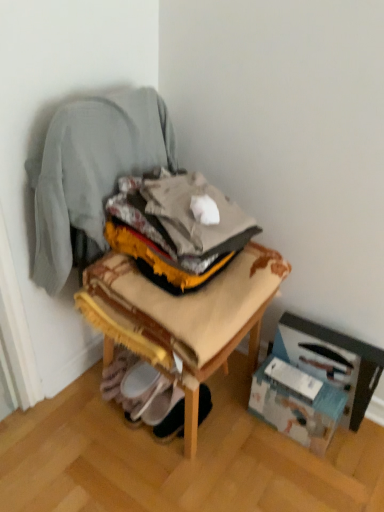
Question: From a real-world perspective, is wooden stool at center under white fabric shoe at lower center?

Choices:
 (A) yes
 (B) no

Answer: (B)

Question: Is wooden stool at center looking in the opposite direction of white fabric shoe at lower center?

Choices:
 (A) no
 (B) yes

Answer: (A)

Question: Is wooden stool at center directly adjacent to white fabric shoe at lower center?

Choices:
 (A) no
 (B) yes

Answer: (A)

Question: Does wooden stool at center appear on the right side of white fabric shoe at lower center?

Choices:
 (A) no
 (B) yes

Answer: (B)

Question: From the image's perspective, is wooden stool at center under white fabric shoe at lower center?

Choices:
 (A) yes
 (B) no

Answer: (B)

Question: Considering the positions of white fabric shoe at lower center and wooden chair at center in the image, is white fabric shoe at lower center taller or shorter than wooden chair at center?

Choices:
 (A) tall
 (B) short

Answer: (B)

Question: Considering the positions of white fabric shoe at lower center and wooden chair at center in the image, is white fabric shoe at lower center wider or thinner than wooden chair at center?

Choices:
 (A) thin
 (B) wide

Answer: (A)

Question: Is white fabric shoe at lower center to the left or to the right of wooden chair at center in the image?

Choices:
 (A) right
 (B) left

Answer: (A)

Question: Is white fabric shoe at lower center in front of or behind wooden chair at center in the image?

Choices:
 (A) behind
 (B) front

Answer: (A)

Question: Is wooden chair at center situated inside wooden stool at center or outside?

Choices:
 (A) outside
 (B) inside

Answer: (A)

Question: In terms of height, does wooden chair at center look taller or shorter compared to wooden stool at center?

Choices:
 (A) short
 (B) tall

Answer: (B)

Question: In the image, is wooden chair at center on the left side or the right side of wooden stool at center?

Choices:
 (A) left
 (B) right

Answer: (A)

Question: From a real-world perspective, is wooden chair at center positioned above or below wooden stool at center?

Choices:
 (A) above
 (B) below

Answer: (A)

Question: From the image's perspective, is wooden stool at center located above or below white cardboard box at lower right, which appears as the first cardboard box when viewed from the right?

Choices:
 (A) below
 (B) above

Answer: (B)

Question: Considering their positions, is wooden stool at center located in front of or behind white cardboard box at lower right, marked as the 2th cardboard box in a left-to-right arrangement?

Choices:
 (A) behind
 (B) front

Answer: (B)